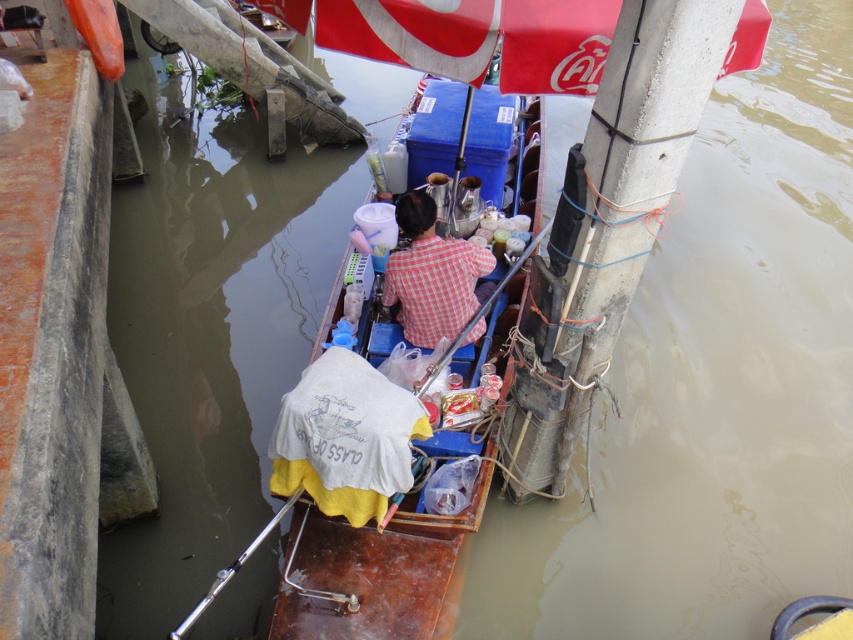
Does rusty wood boat at center appear under red checkered shirt at center?

Correct, rusty wood boat at center is located below red checkered shirt at center.

Is point (297, 563) in front of point (412, 196)?

Yes, point (297, 563) is in front of point (412, 196).

Between point (308, 620) and point (399, 205), which one is positioned behind?

The point (399, 205) is behind.

Locate an element on the screen. rusty wood boat at center is located at coordinates point(376,579).